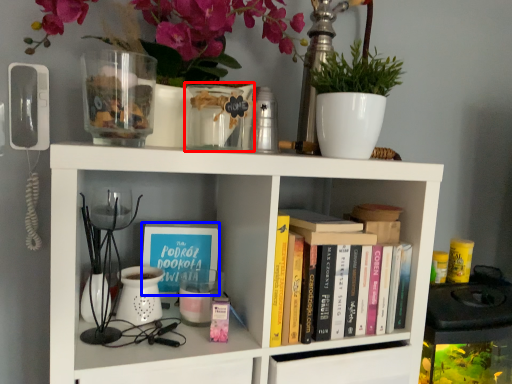
Question: Which object appears farthest to the camera in this image, glass vase (highlighted by a red box) or book cover (highlighted by a blue box)?

Choices:
 (A) glass vase
 (B) book cover

Answer: (B)